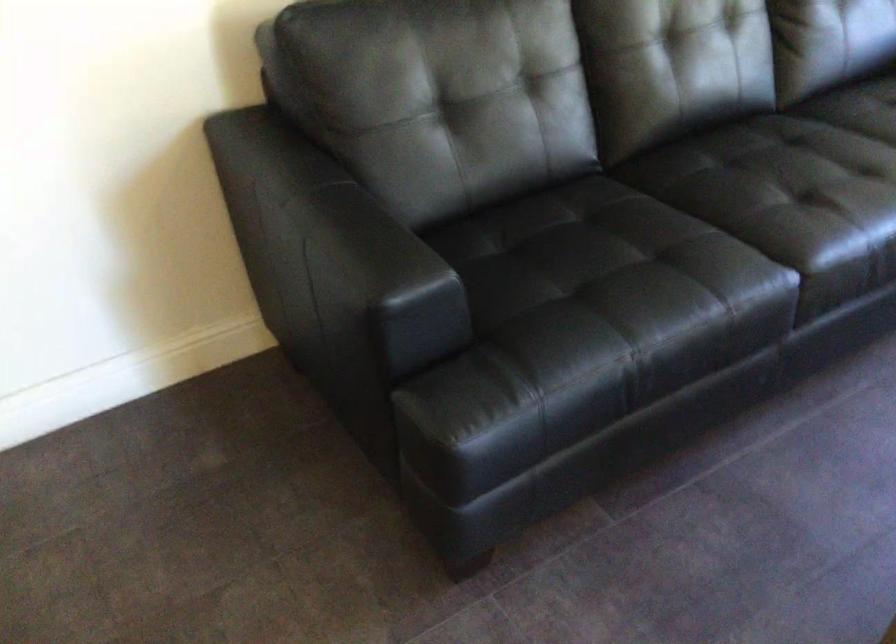
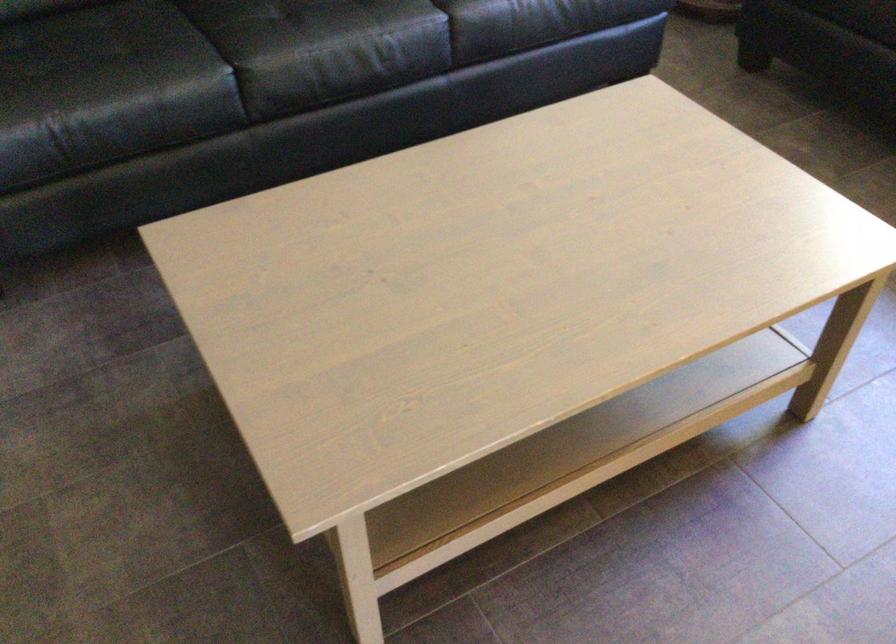
In the second image, find the point that corresponds to point 787,278 in the first image.

(221, 78)